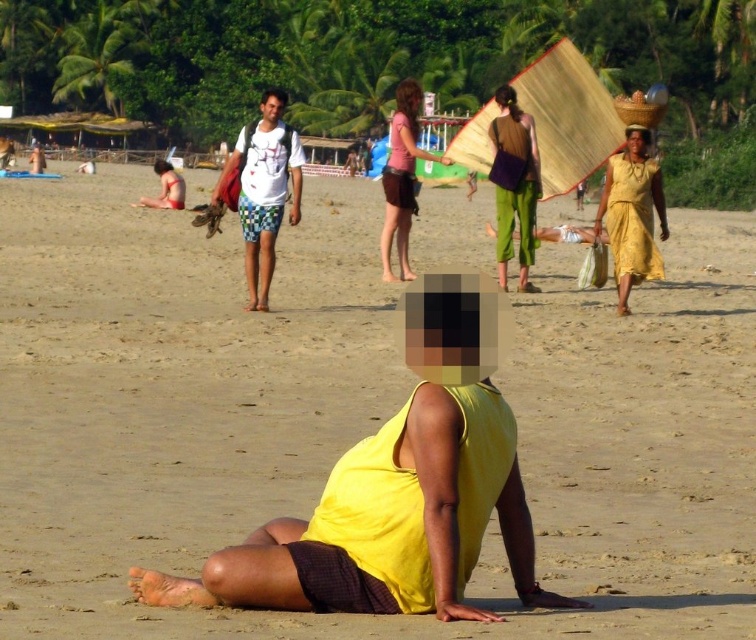
Which is in front, point (276, 214) or point (166, 202)?

Point (276, 214) is more forward.

Can you confirm if white printed t-shirt at center is shorter than red swimsuit at left?

Yes, white printed t-shirt at center is shorter than red swimsuit at left.

Which is behind, point (256, 160) or point (160, 188)?

The point (160, 188) is more distant.

In order to click on white printed t-shirt at center in this screenshot , I will do `click(262, 189)`.

Who is taller, matte brown bag at center or red swimsuit at left?

red swimsuit at left

Which is more to the left, matte brown bag at center or red swimsuit at left?

From the viewer's perspective, red swimsuit at left appears more on the left side.

Between point (497, 232) and point (166, 164), which one is positioned behind?

Point (166, 164)

You are a GUI agent. You are given a task and a screenshot of the screen. Output one action in this format:
    pyautogui.click(x=<x>, y=<y>)
    Task: Click on the matte brown bag at center
    Image resolution: width=756 pixels, height=640 pixels.
    Given the screenshot: What is the action you would take?
    pyautogui.click(x=513, y=184)

Can you confirm if white printed t-shirt at center is thinner than yellow fabric dress at right?

No, white printed t-shirt at center is not thinner than yellow fabric dress at right.

From the picture: Which of these two, white printed t-shirt at center or yellow fabric dress at right, stands shorter?

yellow fabric dress at right is shorter.

Is point (274, 138) closer to camera compared to point (618, 275)?

Yes, it is.

Where is `white printed t-shirt at center`? The height and width of the screenshot is (640, 756). white printed t-shirt at center is located at coordinates (262, 189).